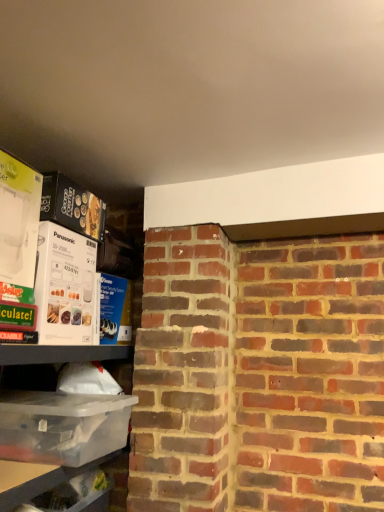
Question: Does white cardboard box at left, the 2th box when ordered from bottom to top, have a greater height compared to white cardboard box at upper left, which is the 3th box from bottom to top?

Choices:
 (A) no
 (B) yes

Answer: (B)

Question: Are white cardboard box at left, acting as the second box starting from the top, and white cardboard box at upper left, which is the 3th box from bottom to top, far apart?

Choices:
 (A) no
 (B) yes

Answer: (A)

Question: Does white cardboard box at left, acting as the second box starting from the top, touch white cardboard box at upper left, which is the 3th box from bottom to top?

Choices:
 (A) yes
 (B) no

Answer: (B)

Question: Is white cardboard box at left, the 2th box when ordered from bottom to top, looking in the opposite direction of white cardboard box at upper left, which is the 3th box from bottom to top?

Choices:
 (A) yes
 (B) no

Answer: (B)

Question: Considering the relative sizes of white cardboard box at left, acting as the second box starting from the top, and white cardboard box at upper left, which is the 3th box from bottom to top, in the image provided, is white cardboard box at left, acting as the second box starting from the top, wider than white cardboard box at upper left, which is the 3th box from bottom to top,?

Choices:
 (A) no
 (B) yes

Answer: (B)

Question: Is white cardboard box at upper left, positioned as the first box in top-to-bottom order, inside white cardboard box at left, acting as the second box starting from the top?

Choices:
 (A) no
 (B) yes

Answer: (A)

Question: Can you confirm if clear plastic container at lower left, placed as the first shelf when sorted from bottom to top, is thinner than white cardboard box at left, acting as the second box starting from the top?

Choices:
 (A) yes
 (B) no

Answer: (A)

Question: Does clear plastic container at lower left, placed as the first shelf when sorted from bottom to top, have a greater width compared to white cardboard box at left, the 2th box when ordered from bottom to top?

Choices:
 (A) no
 (B) yes

Answer: (A)

Question: Is clear plastic container at lower left, arranged as the 2th shelf when viewed from the top, at the right side of white cardboard box at left, acting as the second box starting from the top?

Choices:
 (A) yes
 (B) no

Answer: (B)

Question: Can you confirm if clear plastic container at lower left, arranged as the 2th shelf when viewed from the top, is shorter than white cardboard box at left, acting as the second box starting from the top?

Choices:
 (A) yes
 (B) no

Answer: (A)

Question: From a real-world perspective, is clear plastic container at lower left, placed as the first shelf when sorted from bottom to top, beneath white cardboard box at left, acting as the second box starting from the top?

Choices:
 (A) yes
 (B) no

Answer: (A)

Question: Could you tell me if clear plastic container at lower left, placed as the first shelf when sorted from bottom to top, is turned towards white cardboard box at left, acting as the second box starting from the top?

Choices:
 (A) yes
 (B) no

Answer: (B)

Question: Does clear plastic container at lower left, placed as the first shelf when sorted from bottom to top, lie in front of clear plastic container at left, which appears as the first shelf when viewed from the top?

Choices:
 (A) no
 (B) yes

Answer: (A)